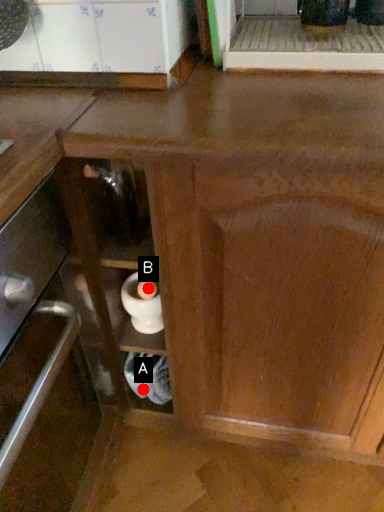
Question: Two points are circled on the image, labeled by A and B beside each circle. Which of the following is the farthest from the observer?

Choices:
 (A) A is further
 (B) B is further

Answer: (A)